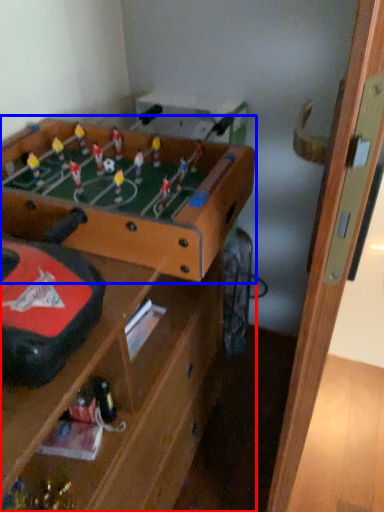
Question: Among these objects, which one is farthest to the camera, table (highlighted by a red box) or table (highlighted by a blue box)?

Choices:
 (A) table
 (B) table

Answer: (B)